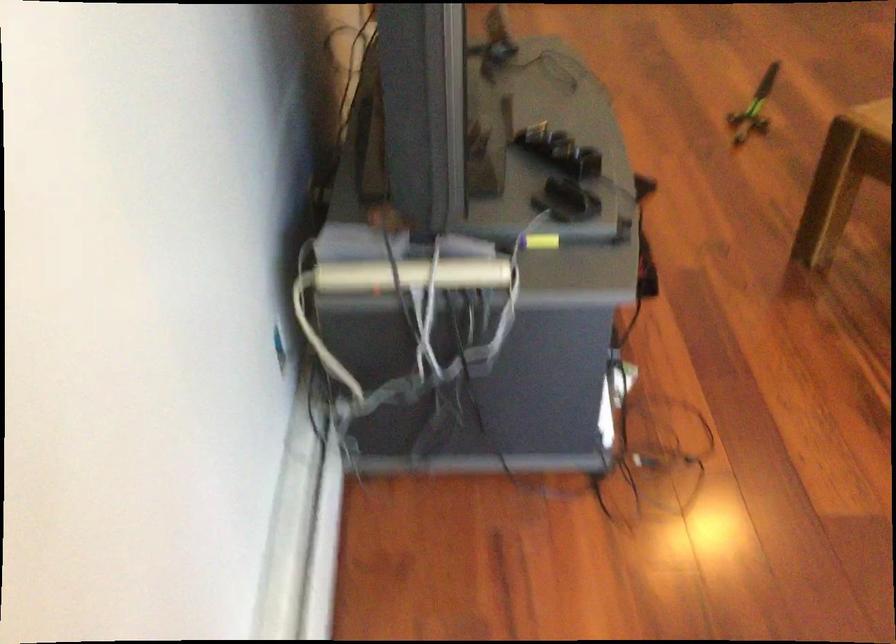
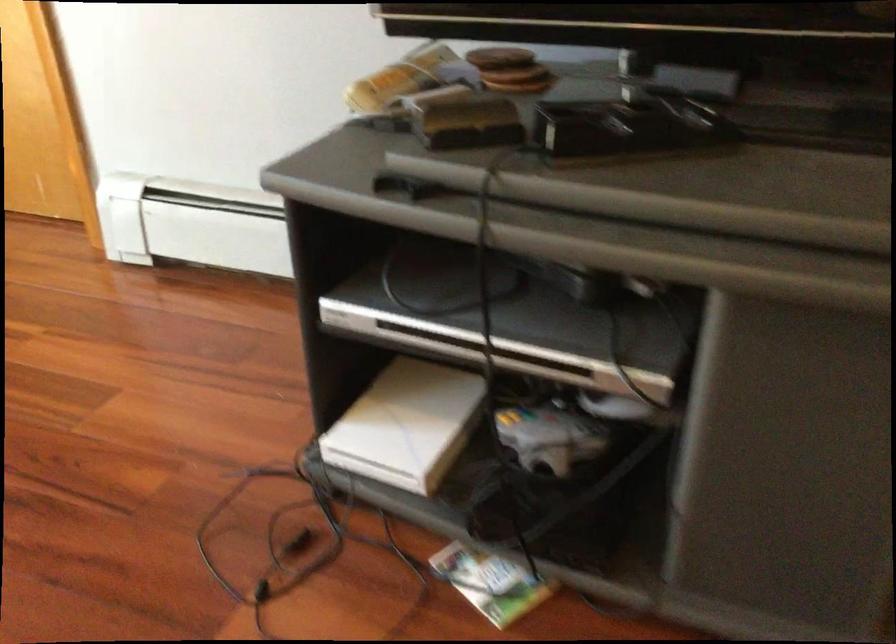
In the second image, find the point that corresponds to [567,144] in the first image.

(627, 126)